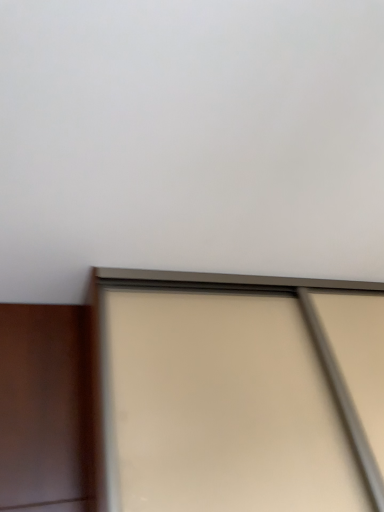
Identify the location of white matte wall at upper center. (189, 141).

The height and width of the screenshot is (512, 384). Describe the element at coordinates (189, 141) in the screenshot. I see `white matte wall at upper center` at that location.

Find the location of `white matte wall at upper center`. white matte wall at upper center is located at coordinates (189, 141).